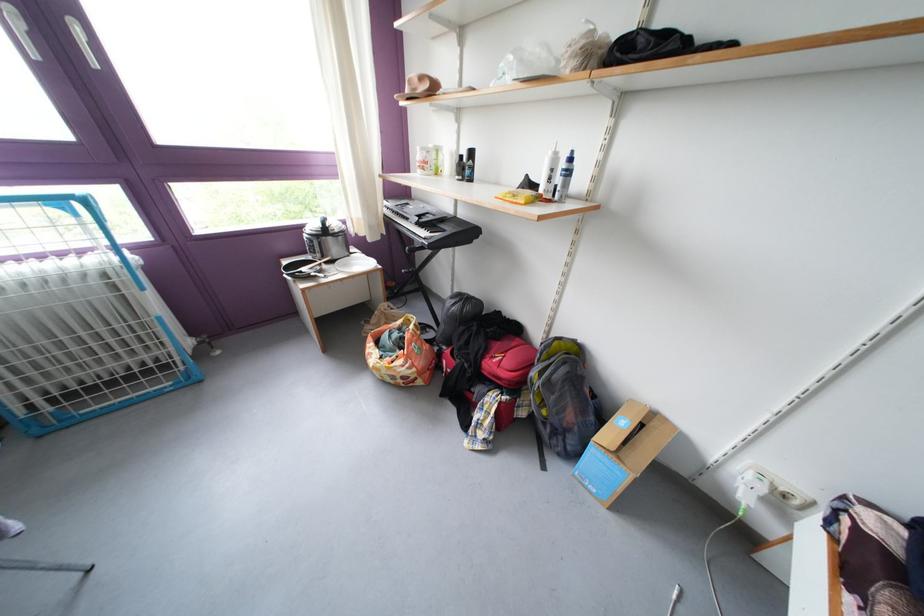
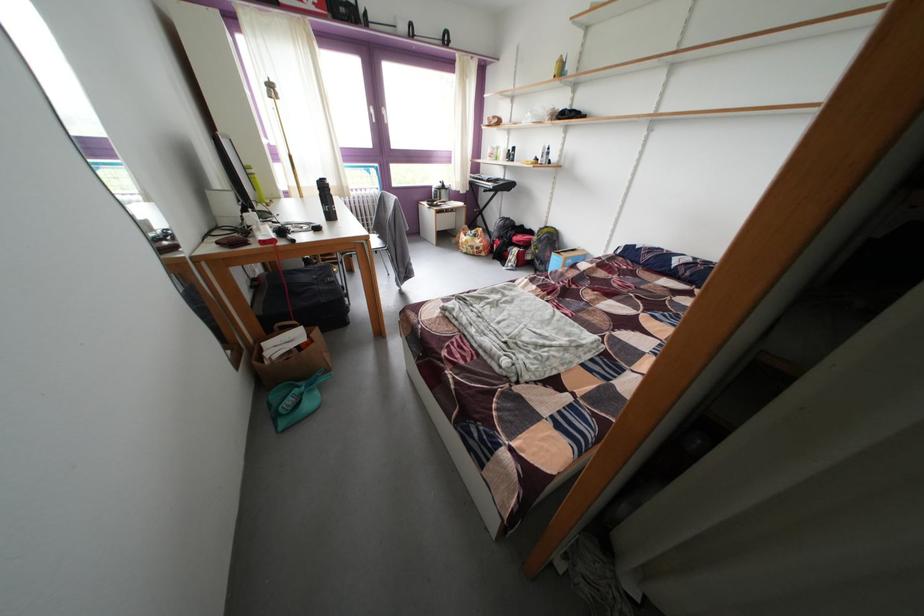
Where in the second image is the point corresponding to the point at 418,225 from the first image?

(492, 185)